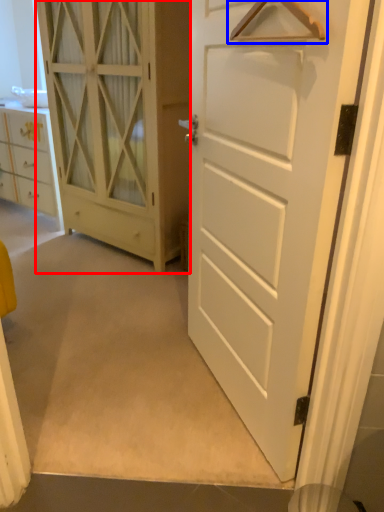
Question: Among these objects, which one is nearest to the camera, door (highlighted by a red box) or hanger (highlighted by a blue box)?

Choices:
 (A) door
 (B) hanger

Answer: (B)